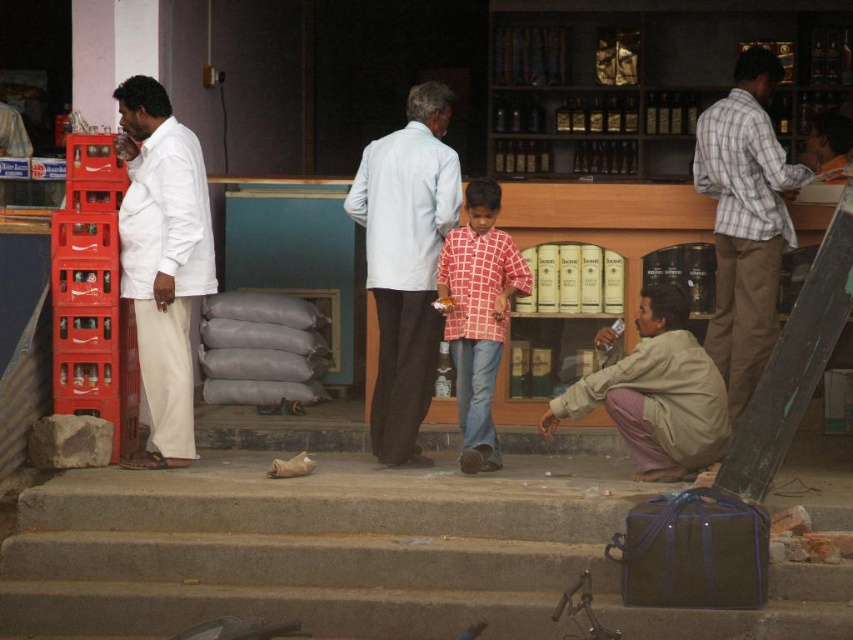
Who is more forward, [415,323] or [686,468]?

Point [686,468]

Image resolution: width=853 pixels, height=640 pixels. What are the coordinates of `light blue cotton shirt at center` in the screenshot? It's located at (405, 262).

Is point (437, 164) less distant than point (639, 304)?

Yes.

Where is `light blue cotton shirt at center`? light blue cotton shirt at center is located at coordinates (405, 262).

Is concrete stairs at lower center behind plaid shirt at right?

No.

Does concrete stairs at lower center have a larger size compared to plaid shirt at right?

Indeed, concrete stairs at lower center has a larger size compared to plaid shirt at right.

Does point (398, 609) come farther from viewer compared to point (751, 250)?

That is False.

Find the location of a particular element. The height and width of the screenshot is (640, 853). concrete stairs at lower center is located at coordinates coord(357,556).

From the picture: Can you confirm if beige cotton shirt at lower right is taller than red checkered shirt at center?

No.

Who is lower down, beige cotton shirt at lower right or red checkered shirt at center?

Positioned lower is beige cotton shirt at lower right.

Is point (573, 412) closer to camera compared to point (497, 314)?

Yes, point (573, 412) is in front of point (497, 314).

This screenshot has height=640, width=853. In order to click on beige cotton shirt at lower right in this screenshot , I will do `click(657, 392)`.